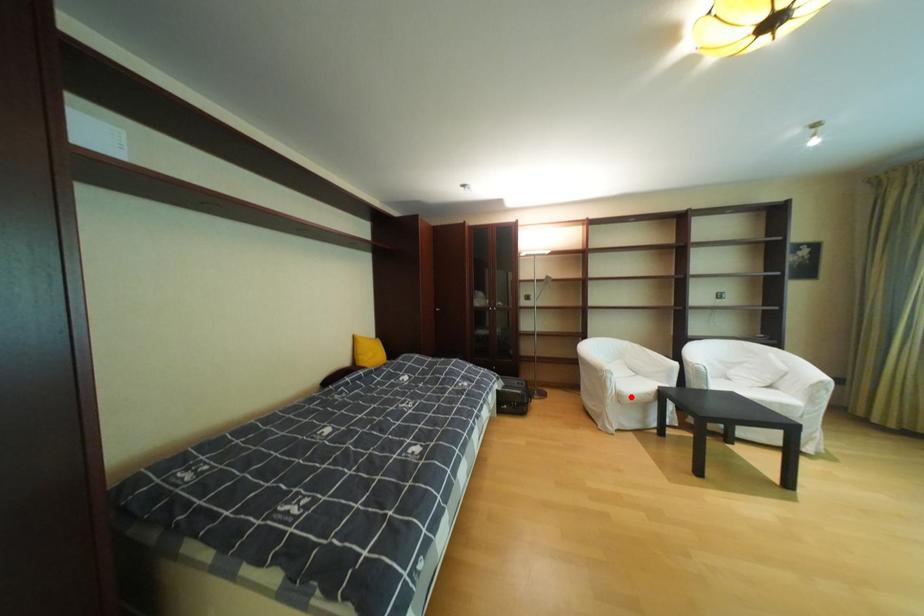
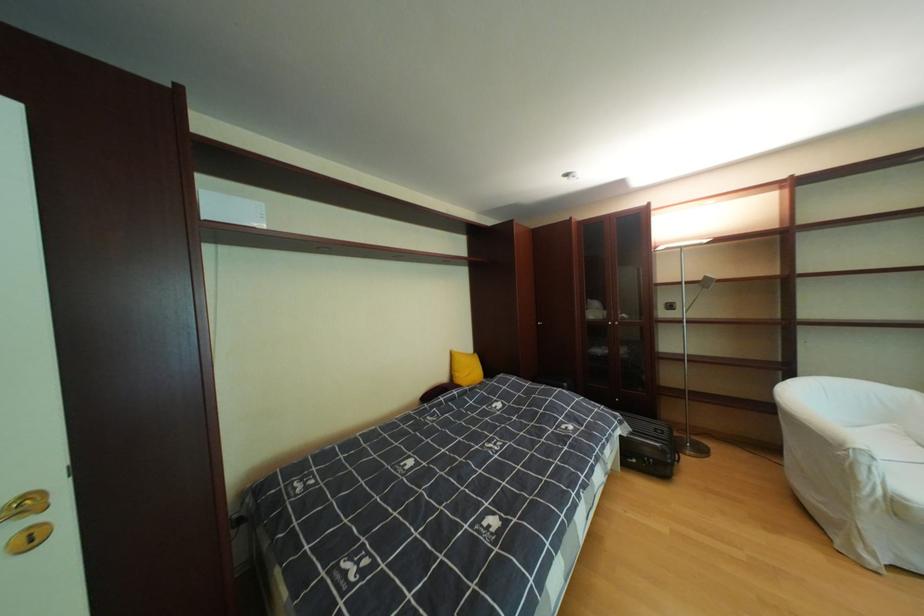
Question: I am providing you with two images of the same scene from different viewpoints. In image1, a red point is highlighted. Considering the same 3D point in image2, which of the following is correct?

Choices:
 (A) It is closer
 (B) It is farther

Answer: (A)